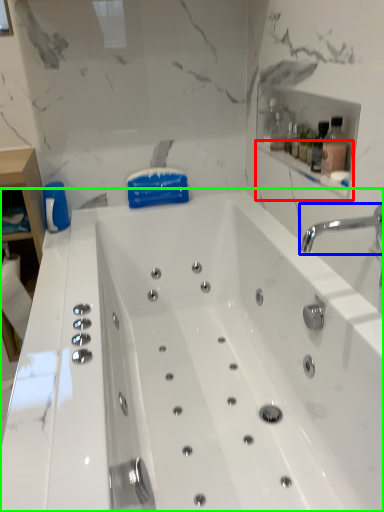
Question: Considering the real-world distances, which object is closest to balustrade (highlighted by a red box)? tap (highlighted by a blue box) or bathtub (highlighted by a green box).

Choices:
 (A) tap
 (B) bathtub

Answer: (A)